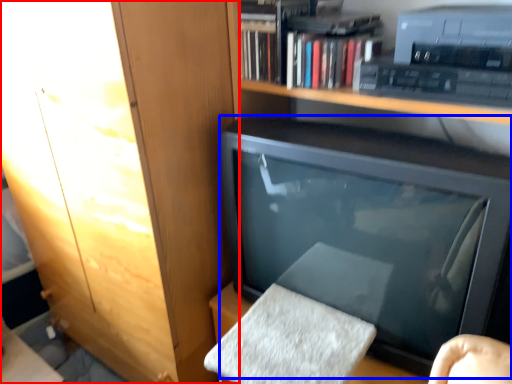
Question: Which of the following is the farthest to the observer, cabinetry (highlighted by a red box) or television (highlighted by a blue box)?

Choices:
 (A) cabinetry
 (B) television

Answer: (A)